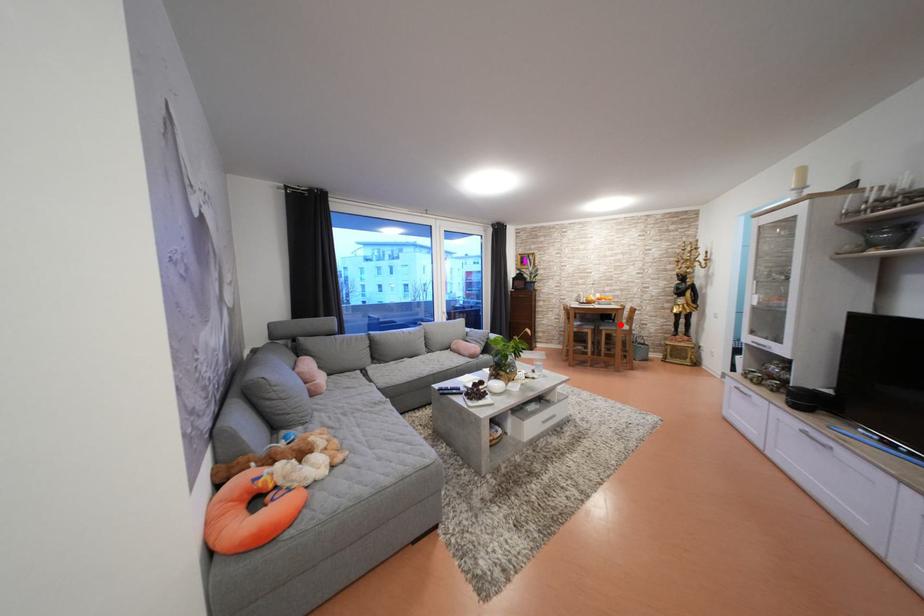
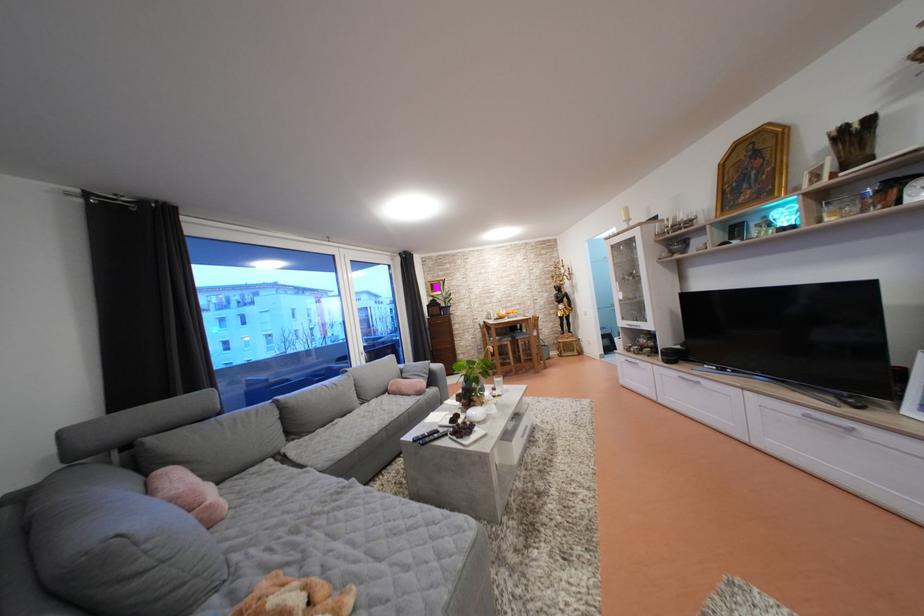
The point at the highlighted location is marked in the first image. Where is the corresponding point in the second image?

(528, 334)